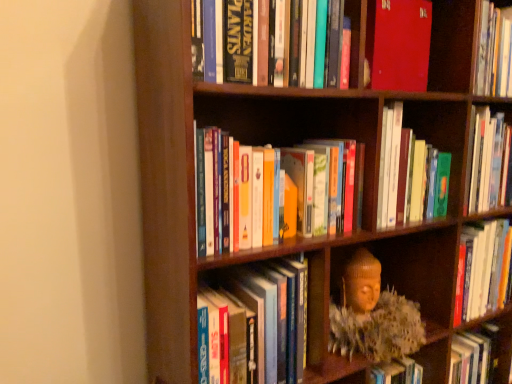
Question: Is matte red book at upper center, which is counted as the first book, starting from the top, positioned far away from wooden bookcase at center?

Choices:
 (A) yes
 (B) no

Answer: (B)

Question: Is matte red book at upper center, marked as the 5th book in a bottom-to-top arrangement, at the left side of wooden bookcase at center?

Choices:
 (A) yes
 (B) no

Answer: (B)

Question: Is matte red book at upper center, marked as the 5th book in a bottom-to-top arrangement, completely or partially outside of wooden bookcase at center?

Choices:
 (A) yes
 (B) no

Answer: (B)

Question: From a real-world perspective, is matte red book at upper center, which is counted as the first book, starting from the top, physically below wooden bookcase at center?

Choices:
 (A) no
 (B) yes

Answer: (A)

Question: Is matte red book at upper center, which is counted as the first book, starting from the top, positioned in front of wooden bookcase at center?

Choices:
 (A) no
 (B) yes

Answer: (A)

Question: In the image, is hardcover books at center, the 3th book in the top-to-bottom sequence, positioned in front of or behind wooden bookcase at center?

Choices:
 (A) front
 (B) behind

Answer: (B)

Question: Is hardcover books at center, the 3th book in the top-to-bottom sequence, wider or thinner than wooden bookcase at center?

Choices:
 (A) wide
 (B) thin

Answer: (B)

Question: Is hardcover books at center, the 3th book in the top-to-bottom sequence, to the left or to the right of wooden bookcase at center in the image?

Choices:
 (A) left
 (B) right

Answer: (B)

Question: In terms of height, does hardcover books at center, the 3th book in the top-to-bottom sequence, look taller or shorter compared to wooden bookcase at center?

Choices:
 (A) tall
 (B) short

Answer: (B)

Question: Would you say hardcover books at center, the second book when ordered from bottom to top, is inside or outside hardcover books at center, which ranks as the 3th book in bottom-to-top order?

Choices:
 (A) inside
 (B) outside

Answer: (B)

Question: Is point (253, 213) closer or farther from the camera than point (384, 210)?

Choices:
 (A) farther
 (B) closer

Answer: (B)

Question: Looking at their shapes, would you say hardcover books at center, arranged as the 4th book when viewed from the top, is wider or thinner than hardcover books at center, which ranks as the 3th book in bottom-to-top order?

Choices:
 (A) thin
 (B) wide

Answer: (A)

Question: From a real-world perspective, relative to hardcover books at center, which ranks as the 3th book in bottom-to-top order, is hardcover books at center, arranged as the 4th book when viewed from the top, vertically above or below?

Choices:
 (A) above
 (B) below

Answer: (B)

Question: Relative to matte red book at upper center, marked as the 5th book in a bottom-to-top arrangement, is hardcover books at center, the 3th book in the top-to-bottom sequence, in front or behind?

Choices:
 (A) behind
 (B) front

Answer: (B)

Question: Would you say hardcover books at center, which ranks as the 3th book in bottom-to-top order, is inside or outside matte red book at upper center, marked as the 5th book in a bottom-to-top arrangement?

Choices:
 (A) outside
 (B) inside

Answer: (A)